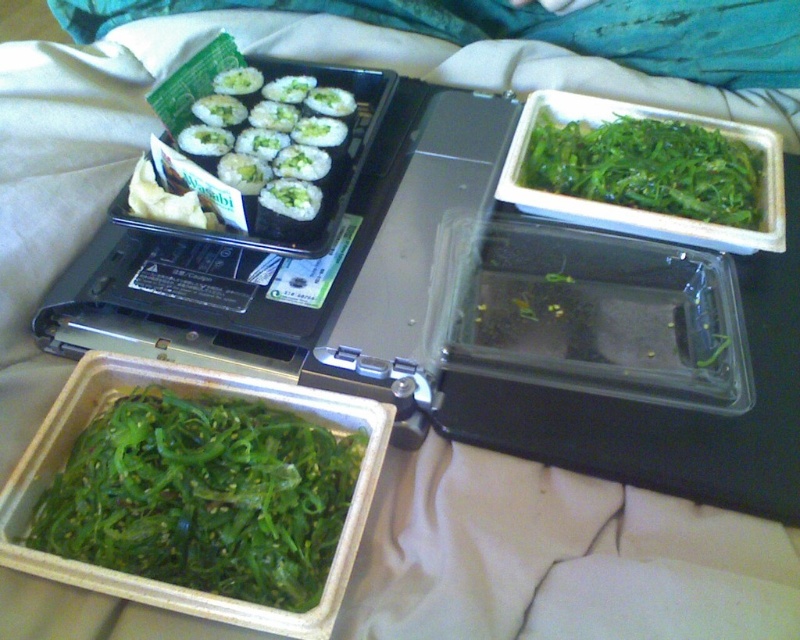
You are organizing a picnic and have brought both the green leafy seaweed at lower left and the white rice with green topping at upper left. Which item requires more space in your picnic basket?

The white rice with green topping at upper left requires more space in the picnic basket because it is larger than the green leafy seaweed at lower left.

What are the coordinates of the green leafy seaweed at lower left?

The green leafy seaweed at lower left is located at coordinates point (204, 497).

You are a food delivery person who just arrived at a customer house and need to deliver the food in the portable warmer. You see the green leafy vegetable at upper right and the white rice with green topping at upper left. Which one is closer to you?

The green leafy vegetable at upper right is further to the viewer than white rice with green topping at upper left, so the white rice with green topping at upper left is closer to you.